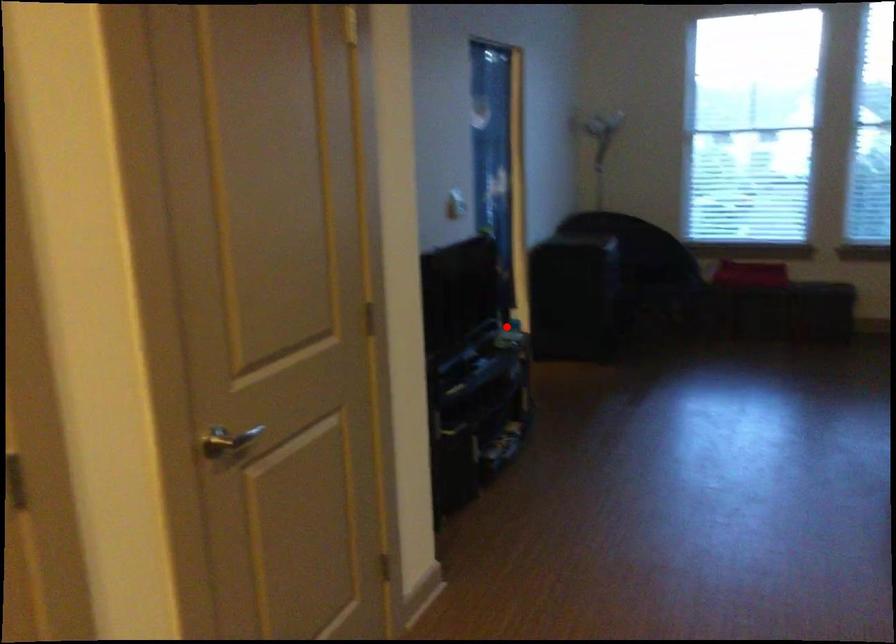
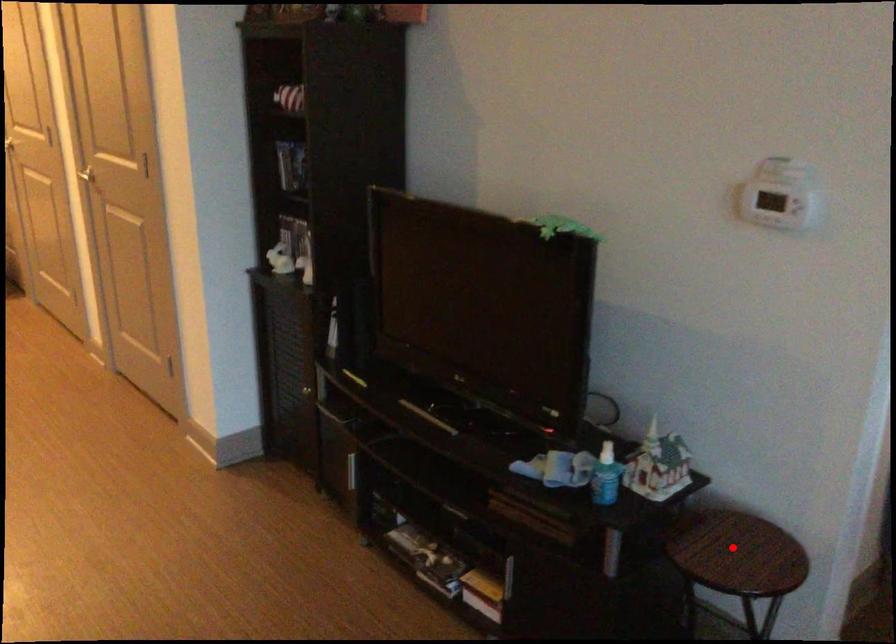
I am providing you with two images of the same scene from different viewpoints. A red point is marked on the first image and another point is marked on the second image. Is the red point in image1 aligned with the point shown in image2?

Yes